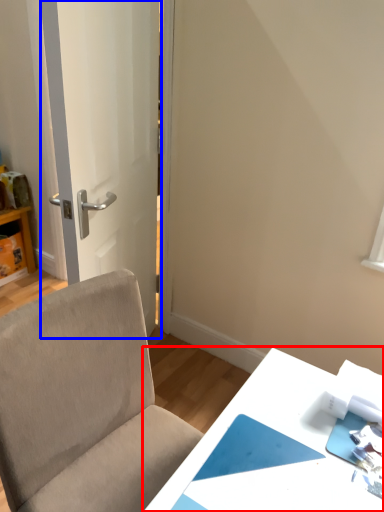
Question: Among these objects, which one is nearest to the camera, table (highlighted by a red box) or door (highlighted by a blue box)?

Choices:
 (A) table
 (B) door

Answer: (A)